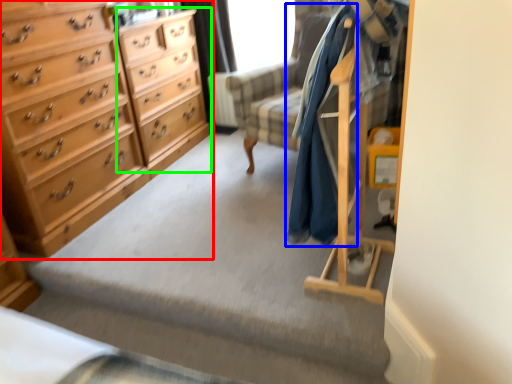
Question: Estimate the real-world distances between objects in this image. Which object is farther from chest of drawers (highlighted by a red box), clothing (highlighted by a blue box) or file cabinet (highlighted by a green box)?

Choices:
 (A) clothing
 (B) file cabinet

Answer: (A)